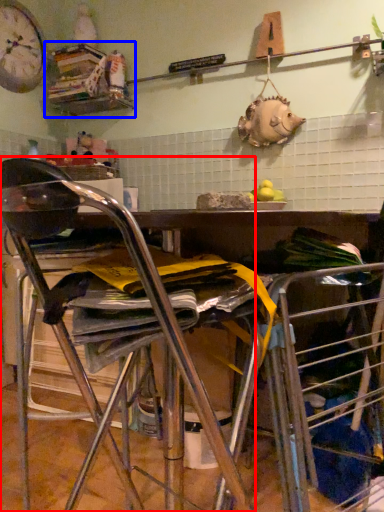
Question: Which point is further to the camera, chair (highlighted by a red box) or shelf (highlighted by a blue box)?

Choices:
 (A) chair
 (B) shelf

Answer: (B)